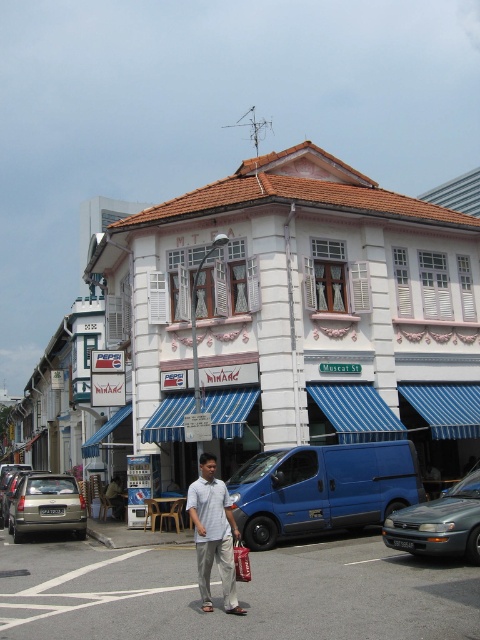
Question: Can you confirm if blue metallic van at center is thinner than metallic gray sedan at center?

Choices:
 (A) yes
 (B) no

Answer: (B)

Question: Considering the real-world distances, which object is closest to the light gray cotton shirt at center?

Choices:
 (A) silver metallic sedan at center-left
 (B) blue metallic van at center

Answer: (B)

Question: Does light gray cotton shirt at center lie in front of red fabric shopping bag at center?

Choices:
 (A) yes
 (B) no

Answer: (A)

Question: Is metallic gray sedan at center wider than silver metallic sedan at center-left?

Choices:
 (A) no
 (B) yes

Answer: (A)

Question: Considering the real-world distances, which object is closest to the light gray cotton shirt at center?

Choices:
 (A) blue metallic van at center
 (B) silver metallic sedan at center-left
 (C) metallic gray sedan at center
 (D) red fabric shopping bag at center

Answer: (D)

Question: Estimate the real-world distances between objects in this image. Which object is farther from the light gray cotton shirt at center?

Choices:
 (A) metallic gray sedan at center
 (B) silver metallic sedan at center-left
 (C) red fabric shopping bag at center
 (D) silver metallic sedan at lower left

Answer: (B)